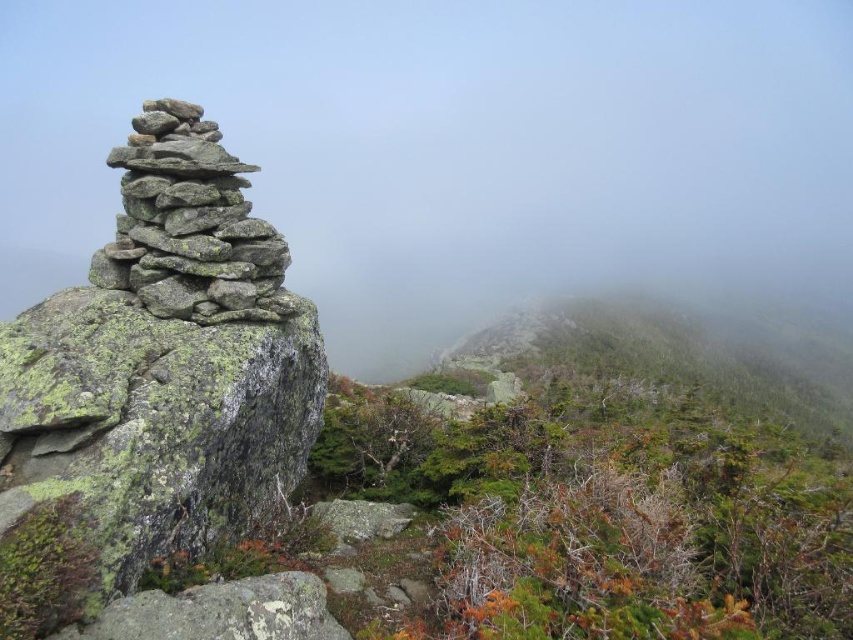
This screenshot has width=853, height=640. Describe the element at coordinates (152, 385) in the screenshot. I see `gray rough stone stack at left` at that location.

Which is more to the right, gray rough stone stack at left or gray rock stack at left?

gray rough stone stack at left

Who is more forward, (85,534) or (183,214)?

Point (85,534) is in front.

The image size is (853, 640). I want to click on gray rough stone stack at left, so click(x=152, y=385).